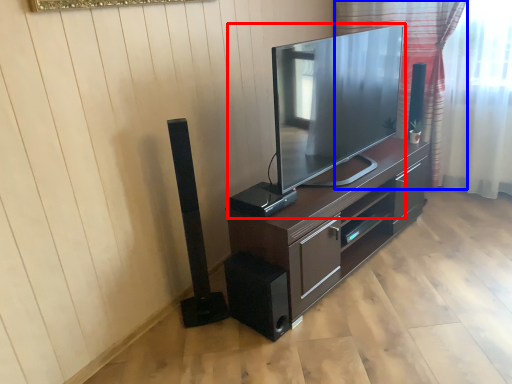
Question: Which point is further to the camera, television (highlighted by a red box) or curtain (highlighted by a blue box)?

Choices:
 (A) television
 (B) curtain

Answer: (B)